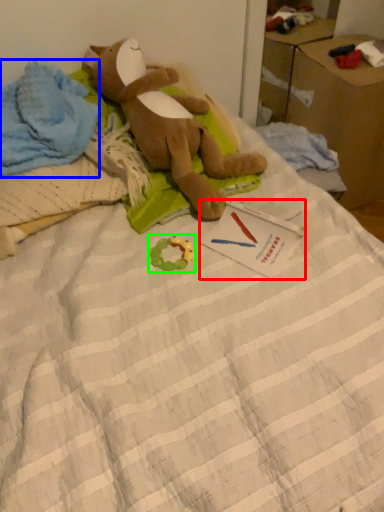
Question: Considering the real-world distances, which object is farthest from postcard (highlighted by a red box)? clothing (highlighted by a blue box) or toy (highlighted by a green box)?

Choices:
 (A) clothing
 (B) toy

Answer: (A)